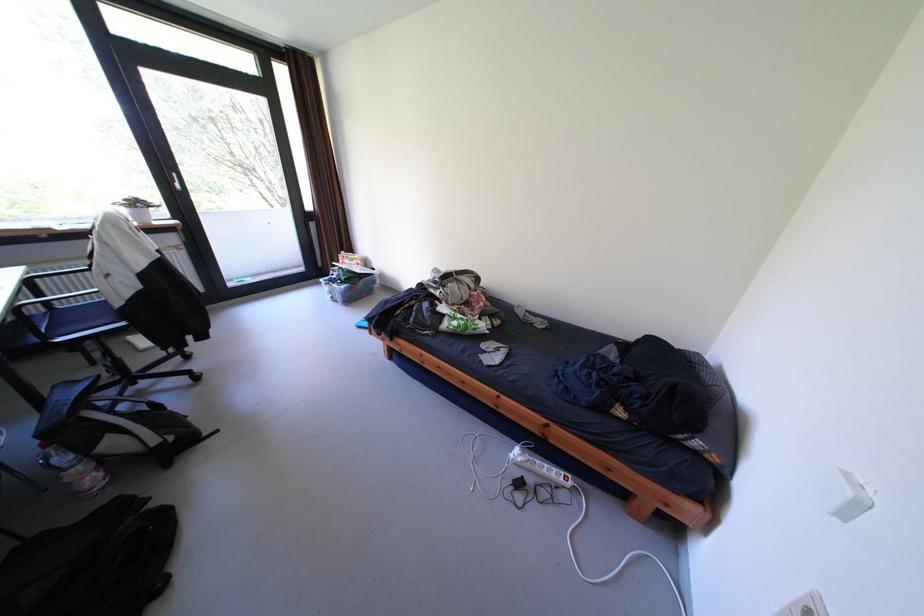
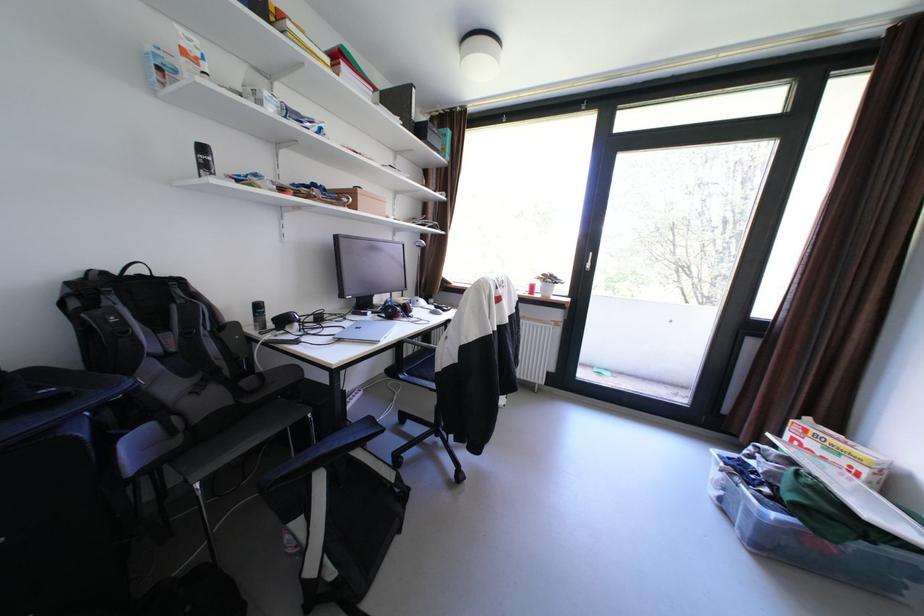
Locate, in the second image, the point that corresponds to [354,286] in the first image.

(784, 516)